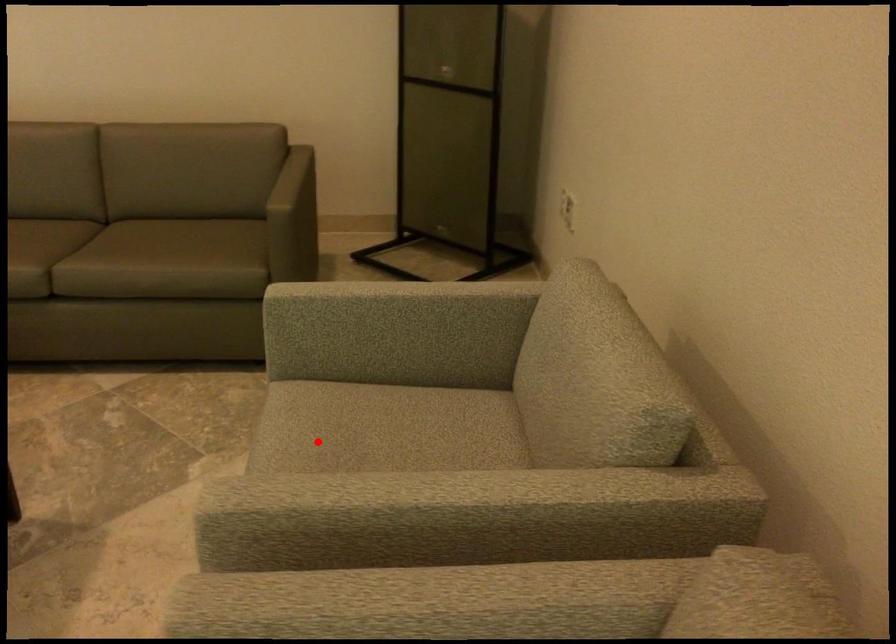
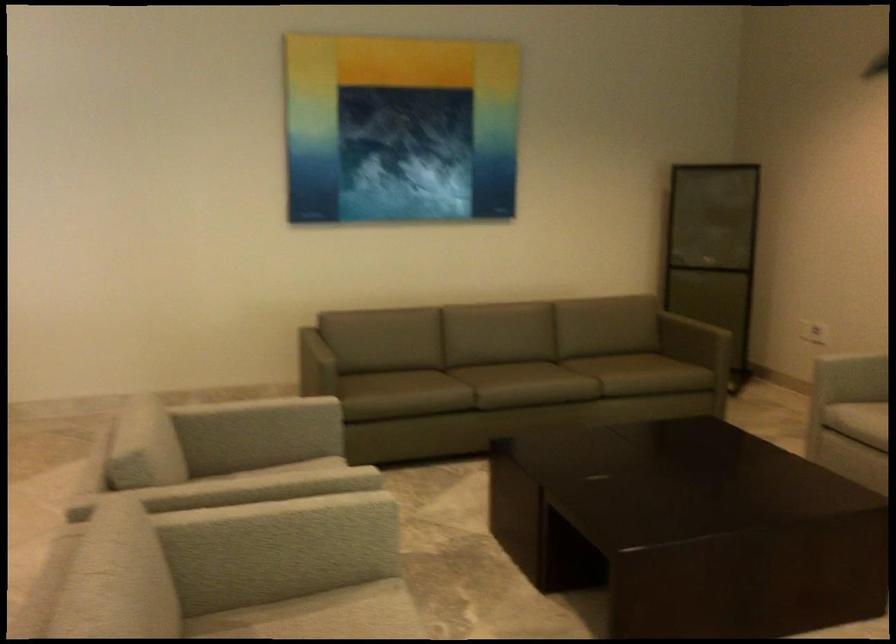
The point at the highlighted location is marked in the first image. Where is the corresponding point in the second image?

(857, 420)